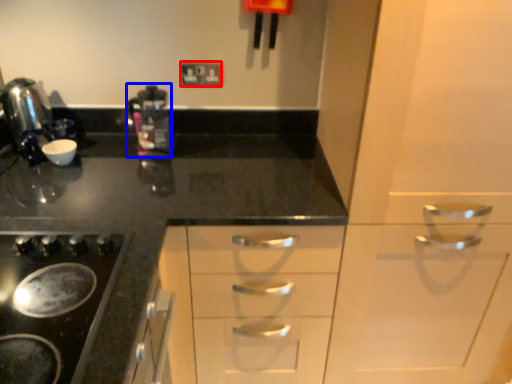
Question: Which object is further to the camera taking this photo, electric outlet (highlighted by a red box) or coffee machine (highlighted by a blue box)?

Choices:
 (A) electric outlet
 (B) coffee machine

Answer: (A)